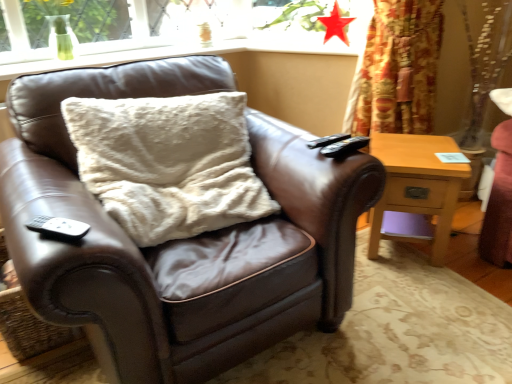
Question: Is black matte remote at lower left, placed as the 2th remote when sorted from right to left, not inside light wood/texture nightstand at right?

Choices:
 (A) yes
 (B) no

Answer: (A)

Question: From a real-world perspective, is black matte remote at lower left, the 2th remote when ordered from back to front, positioned under light wood/texture nightstand at right based on gravity?

Choices:
 (A) no
 (B) yes

Answer: (A)

Question: Considering the relative sizes of black matte remote at lower left, which ranks as the first remote in left-to-right order, and light wood/texture nightstand at right in the image provided, is black matte remote at lower left, which ranks as the first remote in left-to-right order, shorter than light wood/texture nightstand at right?

Choices:
 (A) yes
 (B) no

Answer: (A)

Question: Is black matte remote at lower left, the 2th remote when ordered from back to front, surrounding light wood/texture nightstand at right?

Choices:
 (A) yes
 (B) no

Answer: (B)

Question: Is black matte remote at lower left, the 1th remote ordered from the bottom, looking in the opposite direction of light wood/texture nightstand at right?

Choices:
 (A) yes
 (B) no

Answer: (B)

Question: Is black matte remote at lower left, placed as the 2th remote when sorted from right to left, thinner than light wood/texture nightstand at right?

Choices:
 (A) no
 (B) yes

Answer: (B)

Question: Can you confirm if fuzzy white pillow at center is taller than light wood/texture nightstand at right?

Choices:
 (A) no
 (B) yes

Answer: (A)

Question: Is fuzzy white pillow at center not near light wood/texture nightstand at right?

Choices:
 (A) yes
 (B) no

Answer: (B)

Question: Can light wood/texture nightstand at right be found inside fuzzy white pillow at center?

Choices:
 (A) yes
 (B) no

Answer: (B)

Question: Can you confirm if fuzzy white pillow at center is thinner than light wood/texture nightstand at right?

Choices:
 (A) no
 (B) yes

Answer: (A)

Question: From the image's perspective, is fuzzy white pillow at center above light wood/texture nightstand at right?

Choices:
 (A) no
 (B) yes

Answer: (B)

Question: Is fuzzy white pillow at center directly adjacent to light wood/texture nightstand at right?

Choices:
 (A) no
 (B) yes

Answer: (A)

Question: Does brown leather chair at center come behind matte red star at upper center?

Choices:
 (A) no
 (B) yes

Answer: (A)